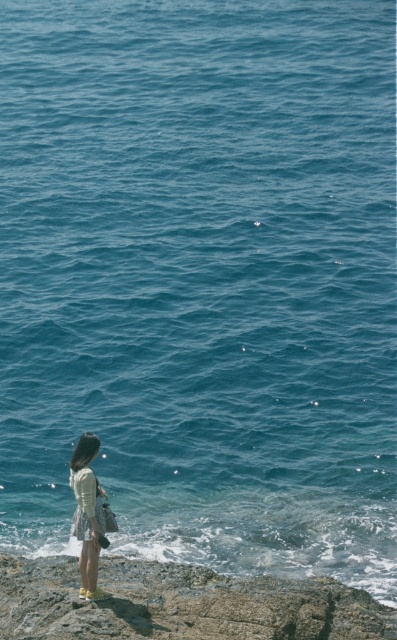
Looking at this image, you are a photographer trying to capture the light yellow fabric skirt at lower left and the rough stone cliff at lower left in the same frame. Which object should you focus on first to ensure both are in the shot?

Since the rough stone cliff at lower left is smaller than the light yellow fabric skirt at lower left, you should focus on the rough stone cliff at lower left first to ensure it is properly framed alongside the larger skirt.

You are a photographer trying to capture the person in the coastal scene. Which clothing item, the light yellow fabric skirt at lower left or the white cotton dress at lower left, is positioned lower on the person?

The light yellow fabric skirt at lower left is located below the white cotton dress at lower left, so it is positioned lower on the person.

You are a photographer trying to capture a photo of the white cotton dress at lower left and the rough stone cliff at lower left. Based on their positions, which object is closer to the camera?

The white cotton dress at lower left is closer to the camera because it is above the rough stone cliff at lower left, which is positioned below it.